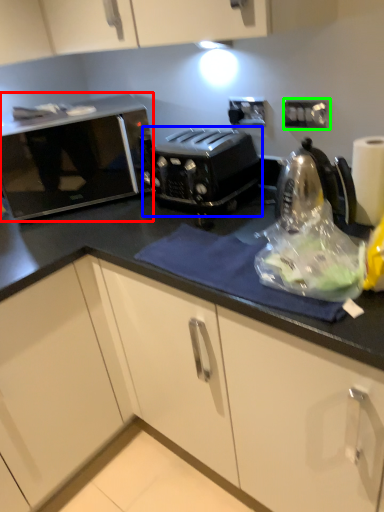
Question: Which is nearer to the home appliance (highlighted by a red box)? toaster (highlighted by a blue box) or electric outlet (highlighted by a green box).

Choices:
 (A) toaster
 (B) electric outlet

Answer: (A)